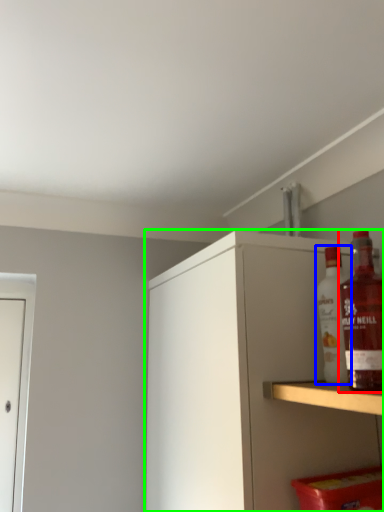
Question: Which is nearer to the bottle (highlighted by a red box)? bottle (highlighted by a blue box) or cabinetry (highlighted by a green box).

Choices:
 (A) bottle
 (B) cabinetry

Answer: (A)